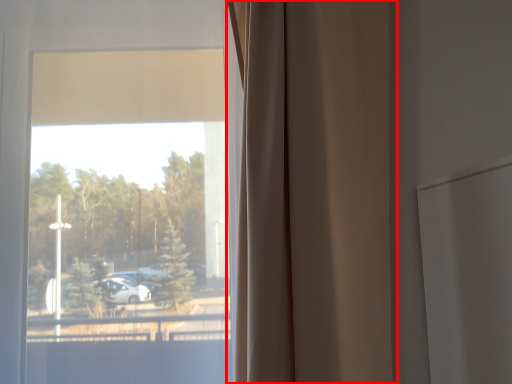
Question: From the image's perspective, considering the relative positions of curtain (annotated by the red box) and window in the image provided, where is curtain (annotated by the red box) located with respect to the staircase?

Choices:
 (A) above
 (B) below

Answer: (B)